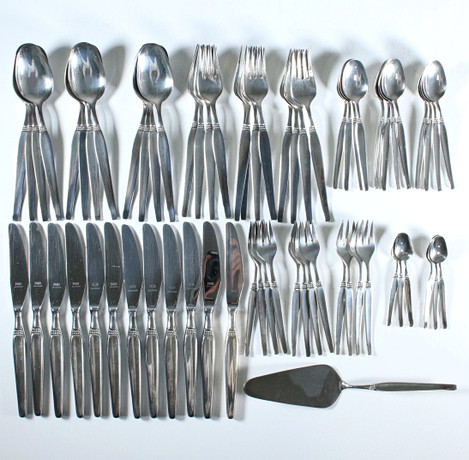
Image resolution: width=469 pixels, height=460 pixels. What are the coordinates of `spoons` in the screenshot? It's located at (154, 65), (78, 68), (31, 74), (135, 79).